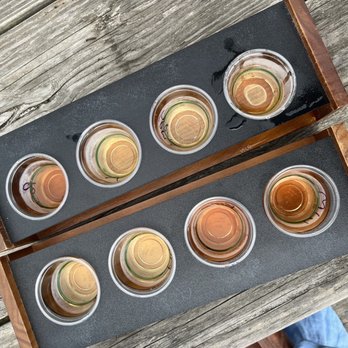
The width and height of the screenshot is (348, 348). What are the coordinates of `wooden surface` in the screenshot? It's located at (307, 301).